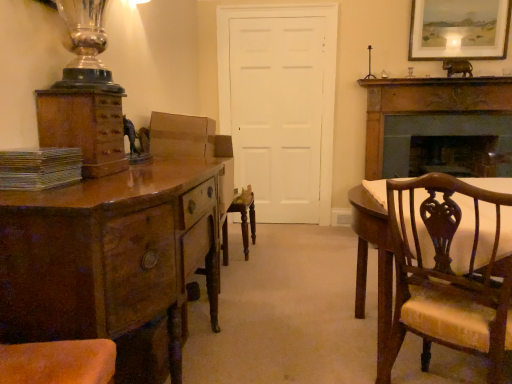
Question: Does shiny brown wood chest of drawers at left have a smaller size compared to metallic silver book at left?

Choices:
 (A) yes
 (B) no

Answer: (B)

Question: Can you confirm if shiny brown wood chest of drawers at left is taller than metallic silver book at left?

Choices:
 (A) no
 (B) yes

Answer: (B)

Question: Is shiny brown wood chest of drawers at left thinner than metallic silver book at left?

Choices:
 (A) yes
 (B) no

Answer: (B)

Question: From the image's perspective, is shiny brown wood chest of drawers at left located above metallic silver book at left?

Choices:
 (A) no
 (B) yes

Answer: (A)

Question: Is shiny brown wood chest of drawers at left positioned behind metallic silver book at left?

Choices:
 (A) no
 (B) yes

Answer: (A)

Question: From their relative heights in the image, would you say dark brown wood fireplace at right is taller or shorter than white matte door at center?

Choices:
 (A) short
 (B) tall

Answer: (A)

Question: From a real-world perspective, is dark brown wood fireplace at right physically located above or below white matte door at center?

Choices:
 (A) above
 (B) below

Answer: (B)

Question: Choose the correct answer: Is dark brown wood fireplace at right inside white matte door at center or outside it?

Choices:
 (A) inside
 (B) outside

Answer: (B)

Question: In terms of width, does dark brown wood fireplace at right look wider or thinner when compared to white matte door at center?

Choices:
 (A) thin
 (B) wide

Answer: (B)

Question: From a real-world perspective, relative to matte white picture frame at upper right, is metallic silver book at left vertically above or below?

Choices:
 (A) below
 (B) above

Answer: (A)

Question: In terms of size, does metallic silver book at left appear bigger or smaller than matte white picture frame at upper right?

Choices:
 (A) big
 (B) small

Answer: (B)

Question: In the image, is metallic silver book at left positioned in front of or behind matte white picture frame at upper right?

Choices:
 (A) front
 (B) behind

Answer: (A)

Question: From the image's perspective, is metallic silver book at left positioned above or below matte white picture frame at upper right?

Choices:
 (A) above
 (B) below

Answer: (B)

Question: From a real-world perspective, relative to matte white picture frame at upper right, is dark brown wood fireplace at right vertically above or below?

Choices:
 (A) below
 (B) above

Answer: (A)

Question: Is dark brown wood fireplace at right situated inside matte white picture frame at upper right or outside?

Choices:
 (A) inside
 (B) outside

Answer: (B)